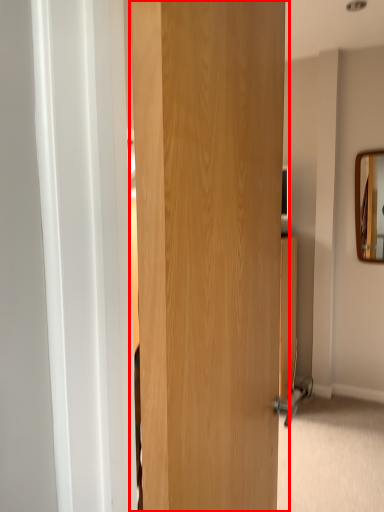
Question: From the image's perspective, where is door (annotated by the red box) located in relation to mirror in the image?

Choices:
 (A) above
 (B) below

Answer: (B)